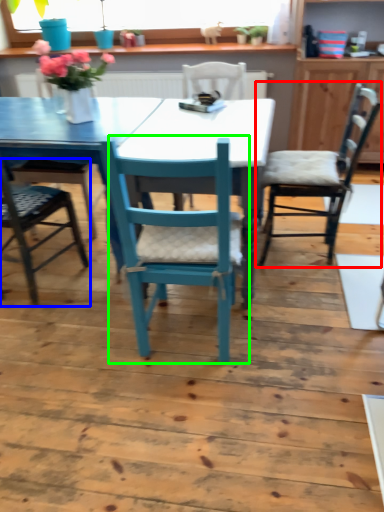
Question: Based on their relative distances, which object is nearer to chair (highlighted by a red box)? Choose from chair (highlighted by a blue box) and chair (highlighted by a green box).

Choices:
 (A) chair
 (B) chair

Answer: (B)